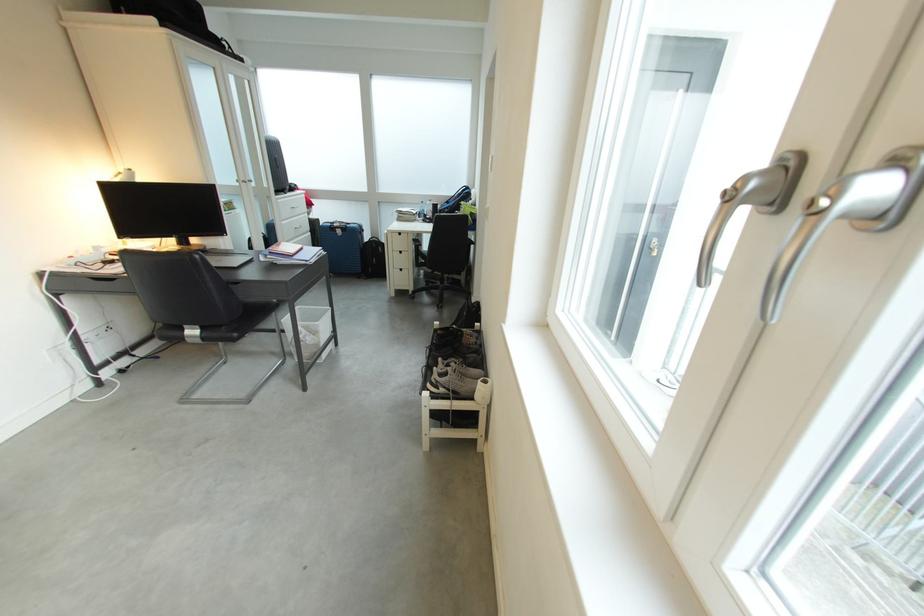
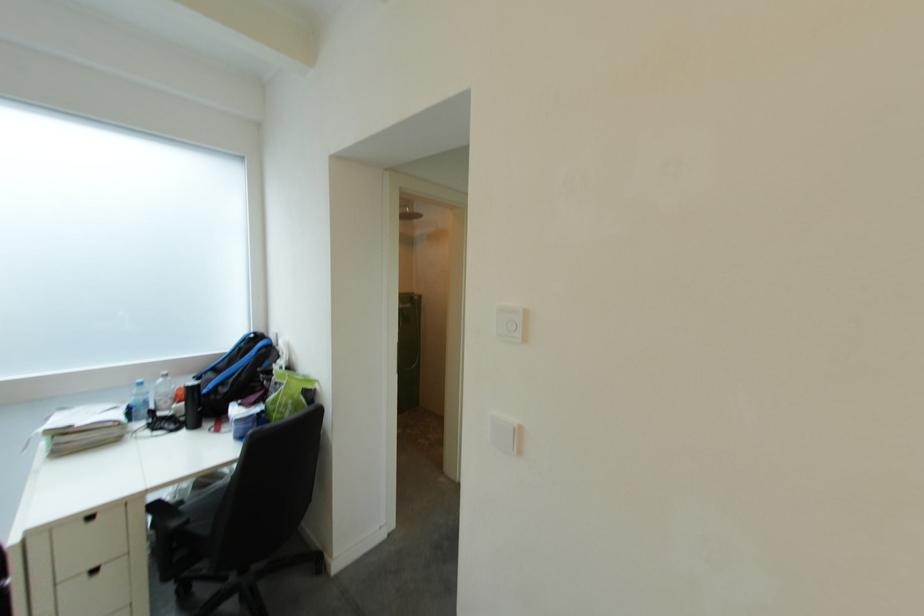
Locate, in the second image, the point that corresponds to pixel 410 216 in the first image.

(73, 436)